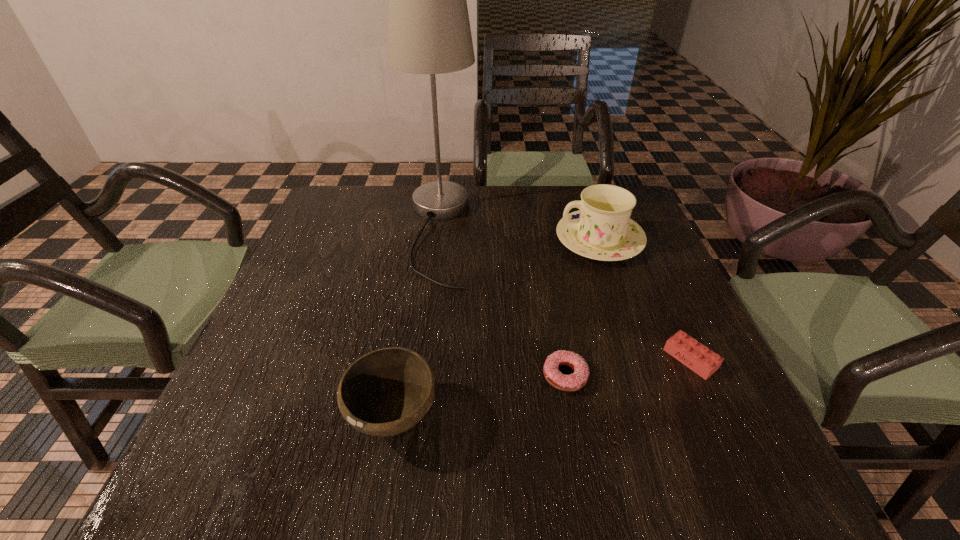
Locate an element on the screen. The width and height of the screenshot is (960, 540). vacant space at the left edge of the desktop is located at coordinates (348, 270).

Image resolution: width=960 pixels, height=540 pixels. Find the location of `free space at the right edge`. free space at the right edge is located at coordinates (655, 261).

Image resolution: width=960 pixels, height=540 pixels. In the image, there is a desktop. Identify the location of free region at the far left corner. (377, 197).

Where is `free spot between the third tallest object and the second tallest object`? free spot between the third tallest object and the second tallest object is located at coordinates (496, 328).

Where is `empty space that is in between the bowl and the doughnut`? Image resolution: width=960 pixels, height=540 pixels. empty space that is in between the bowl and the doughnut is located at coordinates (479, 396).

I want to click on free space between the doughnut and the tallest object, so click(x=501, y=303).

Find the location of a particular element. Image resolution: width=960 pixels, height=540 pixels. free spot between the doughnut and the table lamp is located at coordinates (501, 303).

Where is `free area in between the third shortest object and the Lego`? free area in between the third shortest object and the Lego is located at coordinates (541, 388).

The width and height of the screenshot is (960, 540). Identify the location of unoccupied area between the Lego and the third tallest object. (541, 388).

Identify the location of unoccupied position between the Lego and the second tallest object. (645, 300).